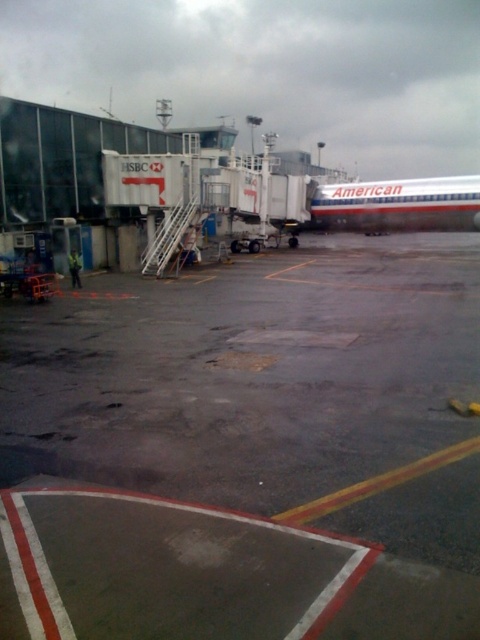
You are a maintenance worker needing to inspect both the wet asphalt tarmac at center and the white metallic airplane at center. Which object should you prioritize inspecting first if you want to cover the larger area first?

The wet asphalt tarmac at center is bigger than the white metallic airplane at center, so you should prioritize inspecting the wet asphalt tarmac at center first to cover the larger area.

You are a pilot taxiing an aircraft on the airport tarmac. You need to avoid the wet asphalt tarmac at center to prevent hydroplaning. Based on your current position at point A, which direction should you steer to stay clear of the wet area?

The wet asphalt tarmac at center is located at point [250,449]. To avoid it, you should steer away from that coordinate to prevent hydroplaning.